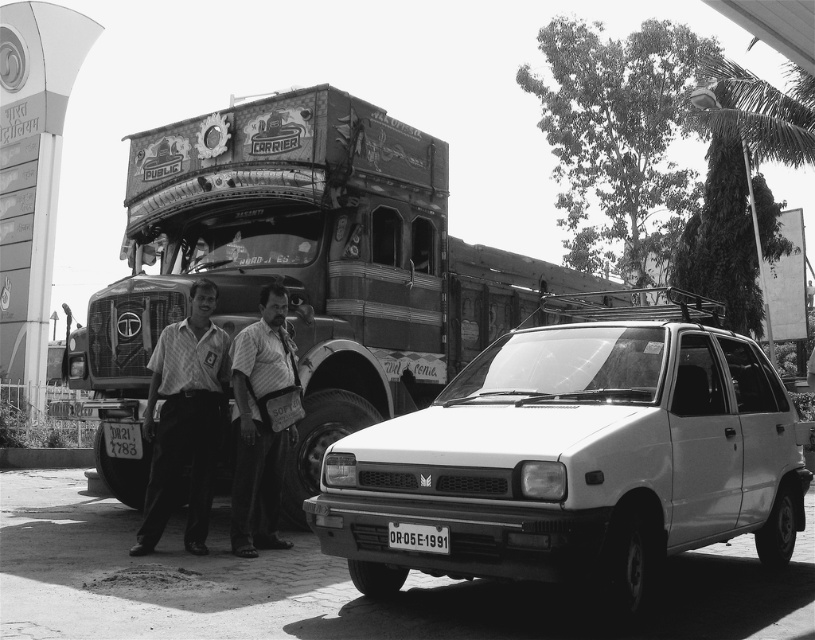
From the picture: Is the position of white matte hatchback at center less distant than that of white plastic license plate at center?

Yes, it is.

Is white matte hatchback at center below white plastic license plate at center?

Correct, white matte hatchback at center is located below white plastic license plate at center.

Measure the distance between point (x=624, y=413) and camera.

A distance of 4.87 meters exists between point (x=624, y=413) and camera.

The image size is (815, 640). I want to click on white matte hatchback at center, so click(x=576, y=456).

Does point (178, 328) come in front of point (399, 532)?

That is False.

Does light brown shirt at center lie in front of white plastic license plate at center?

No.

Is point (157, 436) closer to camera compared to point (430, 540)?

No, it is not.

At what (x,y) coordinates should I click in order to perform the action: click on light brown shirt at center. Please return your answer as a coordinate pair (x, y). This screenshot has width=815, height=640. Looking at the image, I should click on (184, 419).

Between point (217, 339) and point (115, 449), which one is positioned behind?

The point (115, 449) is behind.

Which of these two, light brown shirt at center or black plastic license plate at lower left, stands shorter?

black plastic license plate at lower left is shorter.

The image size is (815, 640). What are the coordinates of `light brown shirt at center` in the screenshot? It's located at (184, 419).